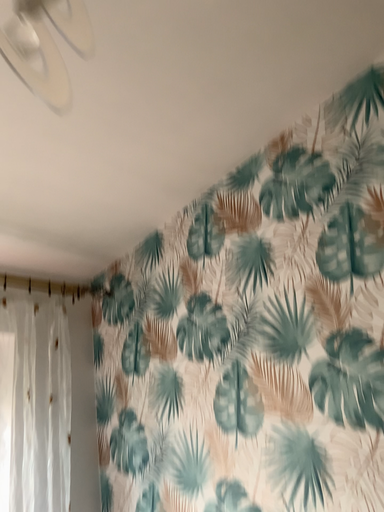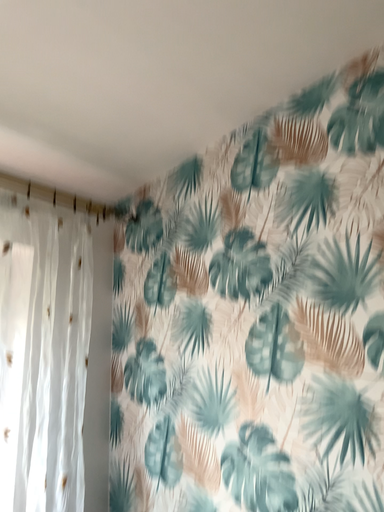
Question: How did the camera likely rotate when shooting the video?

Choices:
 (A) rotated upward
 (B) rotated downward

Answer: (B)